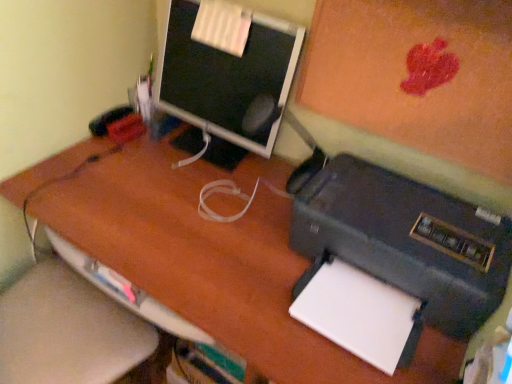
This screenshot has height=384, width=512. I want to click on empty space that is ontop of black matte printer at lower right (from a real-world perspective), so click(x=410, y=215).